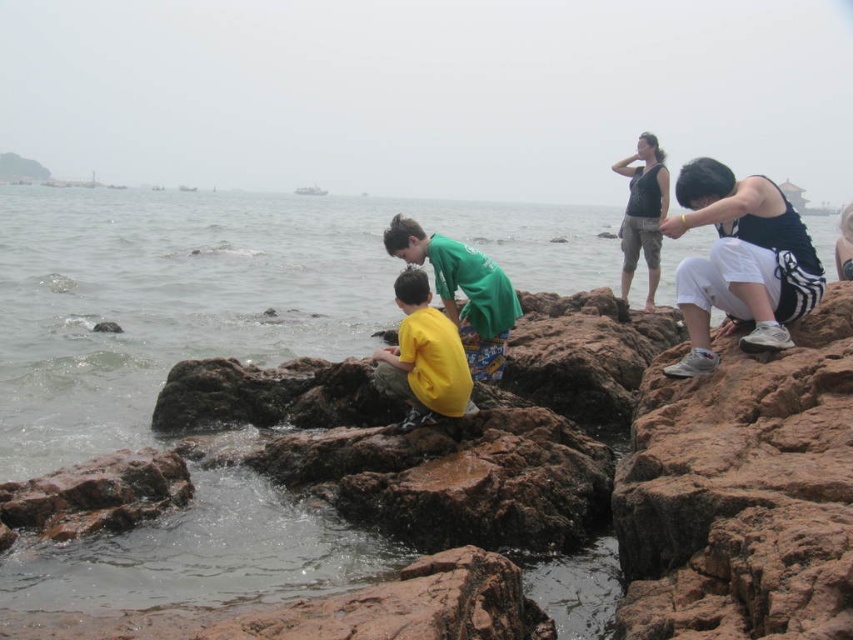
Is point (170, 371) more distant than point (746, 211)?

Yes, it is behind point (746, 211).

Can you confirm if brown rough rocks at center is smaller than white athletic pants at right?

Correct, brown rough rocks at center occupies less space than white athletic pants at right.

At what (x,y) coordinates should I click in order to perform the action: click on brown rough rocks at center. Please return your answer as a coordinate pair (x, y). Looking at the image, I should click on (735, 493).

Identify the location of brown rough rocks at center. (735, 493).

Does white athletic pants at right have a smaller size compared to yellow matte shirt at center?

No.

Does white athletic pants at right have a larger size compared to yellow matte shirt at center?

Correct, white athletic pants at right is larger in size than yellow matte shirt at center.

At what (x,y) coordinates should I click in order to perform the action: click on white athletic pants at right. Please return your answer as a coordinate pair (x, y). Looking at the image, I should click on (740, 260).

The width and height of the screenshot is (853, 640). I want to click on white athletic pants at right, so click(740, 260).

In the scene shown: Does brown rough rocks at center have a greater height compared to green fabric shirt at center?

No, brown rough rocks at center is not taller than green fabric shirt at center.

Is the position of brown rough rocks at center more distant than that of green fabric shirt at center?

No.

Does point (339, 372) lie behind point (422, 248)?

Yes.

This screenshot has height=640, width=853. In order to click on brown rough rocks at center in this screenshot , I will do `click(735, 493)`.